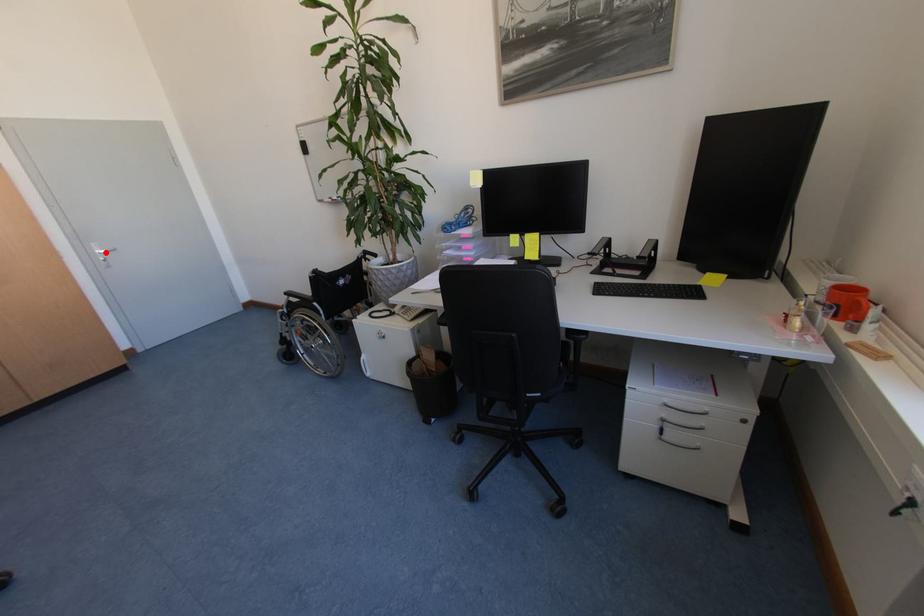
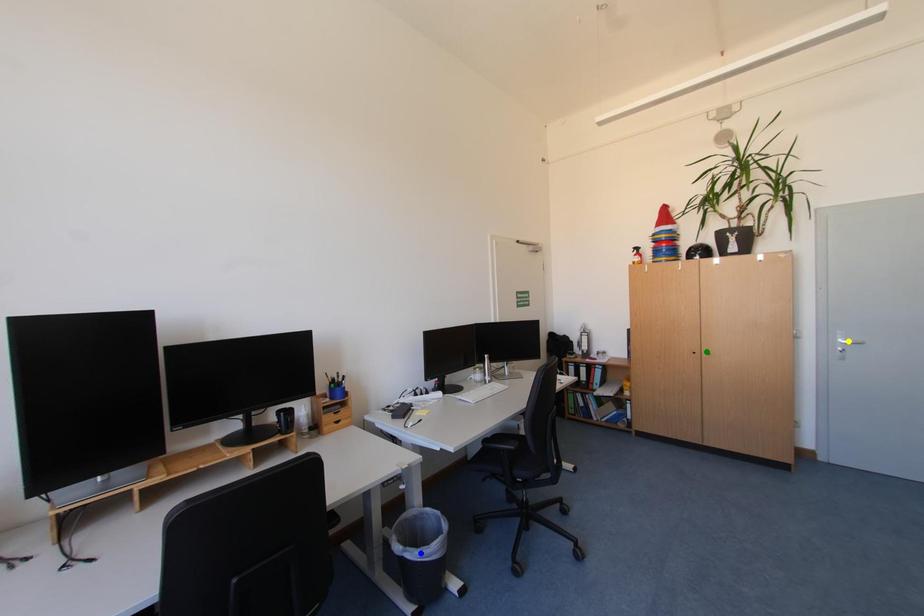
Question: I am providing you with two images of the same scene from different viewpoints. A red point is marked on the first image. You are given multiple points on the second image. Can you choose the point in image 2 that corresponds to the point in image 1?

Choices:
 (A) blue point
 (B) yellow point
 (C) green point

Answer: (B)